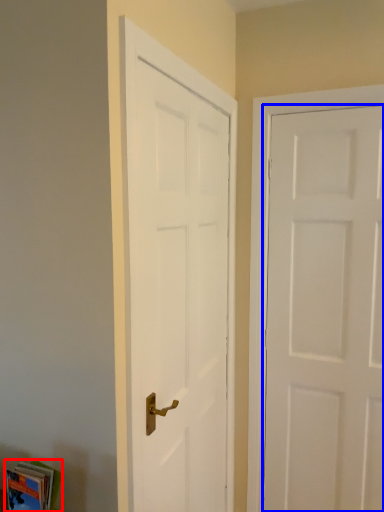
Question: Which object is further to the camera taking this photo, book (highlighted by a red box) or door (highlighted by a blue box)?

Choices:
 (A) book
 (B) door

Answer: (B)